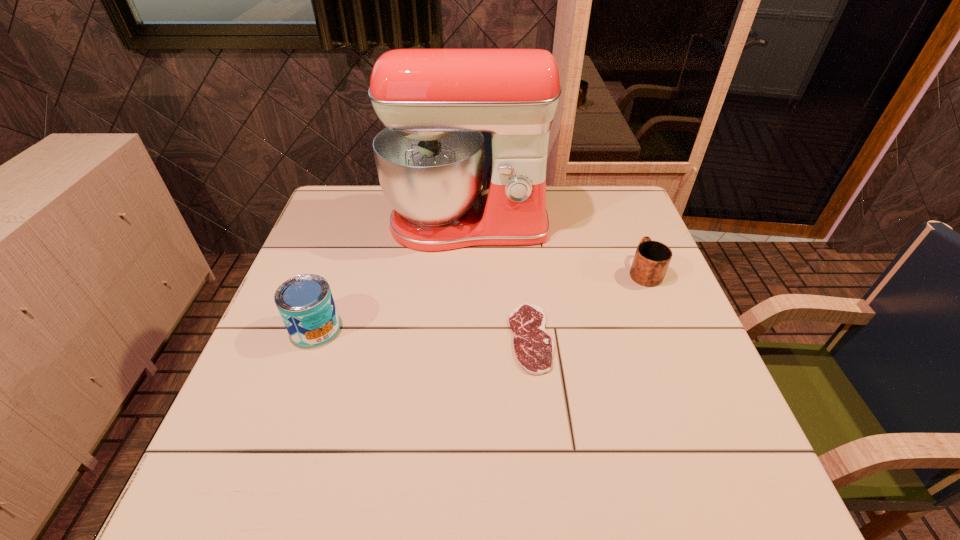
Image resolution: width=960 pixels, height=540 pixels. Find the location of `mixer`. mixer is located at coordinates (435, 103).

At what (x,y) coordinates should I click in order to perform the action: click on can. Please return your answer as a coordinate pair (x, y). Looking at the image, I should click on (305, 302).

Find the location of a particular element. The width and height of the screenshot is (960, 540). the leftmost object is located at coordinates (305, 302).

Find the location of a particular element. This screenshot has height=540, width=960. mug is located at coordinates (652, 258).

You are a GUI agent. You are given a task and a screenshot of the screen. Output one action in this format:
    pyautogui.click(x=<x>, y=<y>)
    Task: Click on the second shortest object
    Image resolution: width=960 pixels, height=540 pixels.
    Given the screenshot: What is the action you would take?
    pyautogui.click(x=652, y=258)

Locate an element on the screen. Image resolution: width=960 pixels, height=540 pixels. steak is located at coordinates (534, 348).

Identify the location of free region located 0.070m on the front-facing side of the tallest object. (466, 273).

This screenshot has height=540, width=960. What are the coordinates of `blank area located 0.160m on the right of the leftmost object` in the screenshot? It's located at (408, 328).

Image resolution: width=960 pixels, height=540 pixels. In order to click on vacant space situated 0.050m on the side of the rightmost object with the handle in this screenshot , I will do `click(633, 244)`.

You are a GUI agent. You are given a task and a screenshot of the screen. Output one action in this format:
    pyautogui.click(x=<x>, y=<y>)
    Task: Click on the vacant region located 0.360m on the side of the rightmost object with the handle
    This screenshot has width=960, height=540.
    Given the screenshot: What is the action you would take?
    pyautogui.click(x=610, y=186)